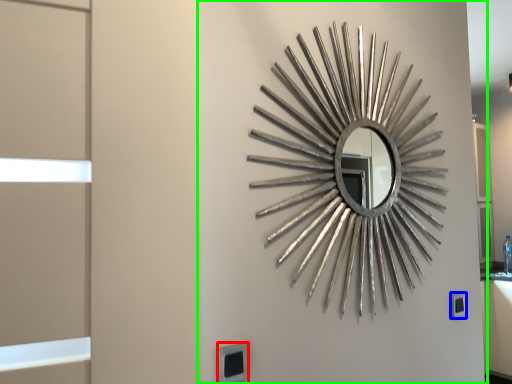
Question: Estimate the real-world distances between objects in this image. Which object is farther from electric outlet (highlighted by a red box), electric outlet (highlighted by a blue box) or backdrop (highlighted by a green box)?

Choices:
 (A) electric outlet
 (B) backdrop

Answer: (A)